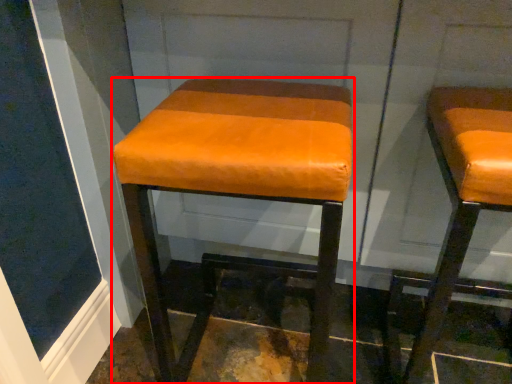
Question: In this image, where is stool (annotated by the red box) located relative to stool?

Choices:
 (A) right
 (B) left

Answer: (B)